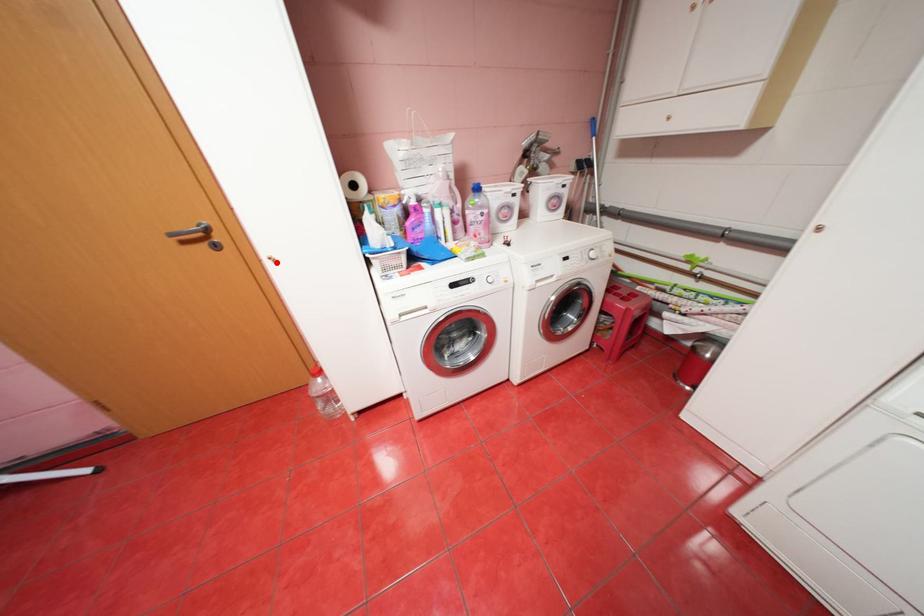
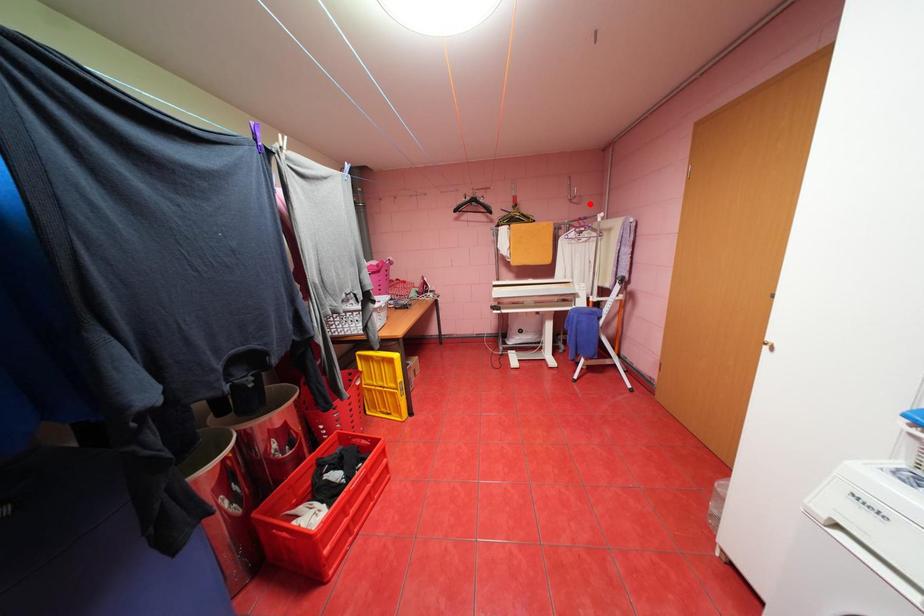
I am providing you with two images of the same scene from different viewpoints. A red point is marked on the first image and another point is marked on the second image. Is the red point in image1 aligned with the point shown in image2?

No